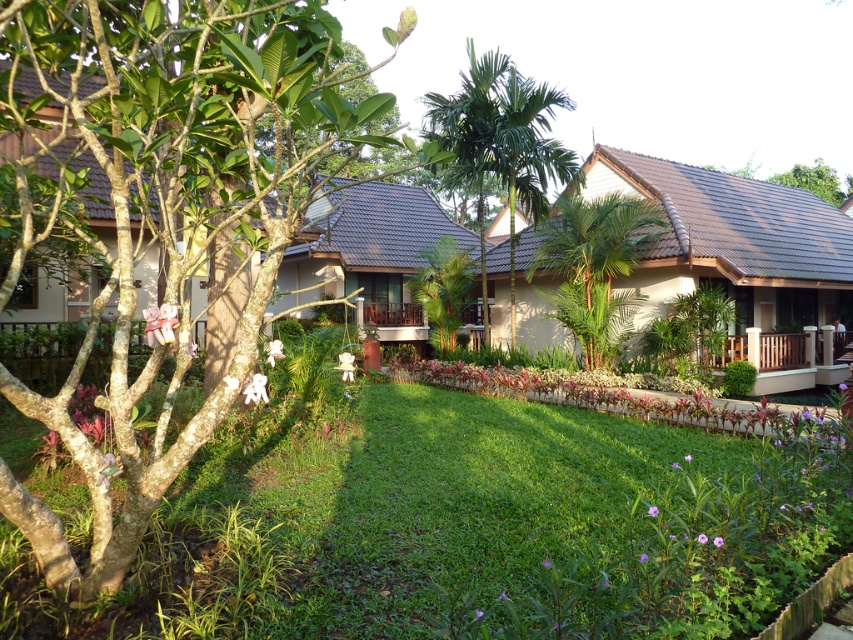
You are standing at the center of the lawn and want to walk towards the point marked as point [589,200]. However, there is another point at point [816,164] behind it. If you walk straight towards the first point, will you pass by the second point before reaching the first one?

No, because point [589,200] is in front of point [816,164], so walking towards the first point means you will reach it before encountering the second point behind it.

You are standing in the middle of the lawn and see the green leafy palm tree at center and the green leafy tree at center. Which one is more to the right?

The green leafy palm tree at center is positioned on the right side of green leafy tree at center, so it is more to the right.

You are standing in the middle of the lawn and want to walk towards the green leafy tree at upper right. Which direction should you move relative to the green leafy palm at center?

To reach the green leafy tree at upper right from the green leafy palm at center, you should move to the right since the green leafy palm at center is positioned to the left of the green leafy tree at upper right.